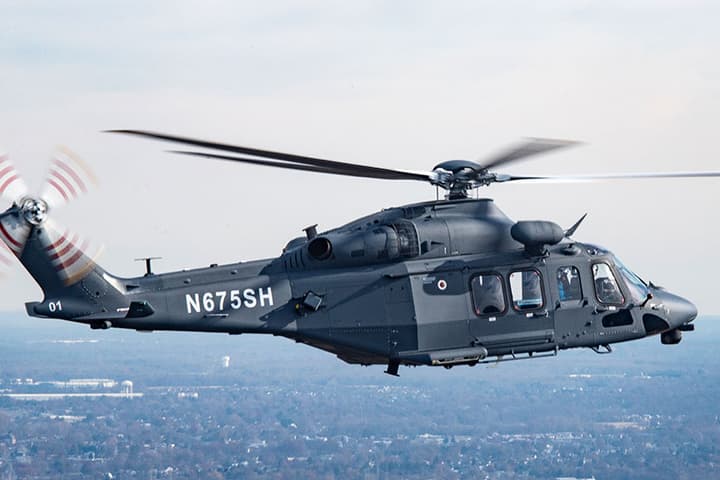
At what (x,y) coordinates should I click in order to perform the action: click on window. Please return your answer as a coordinate pair (x, y). This screenshot has width=720, height=480. Looking at the image, I should click on (500, 288).